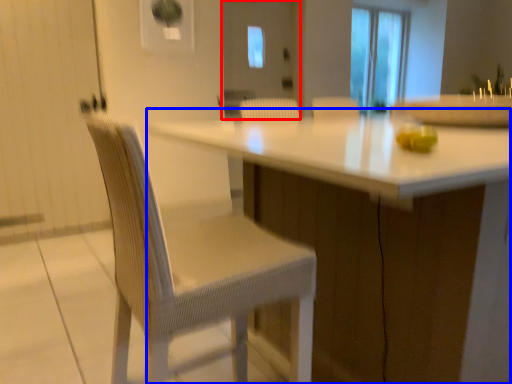
Question: Among these objects, which one is nearest to the camera, screen door (highlighted by a red box) or table (highlighted by a blue box)?

Choices:
 (A) screen door
 (B) table

Answer: (B)